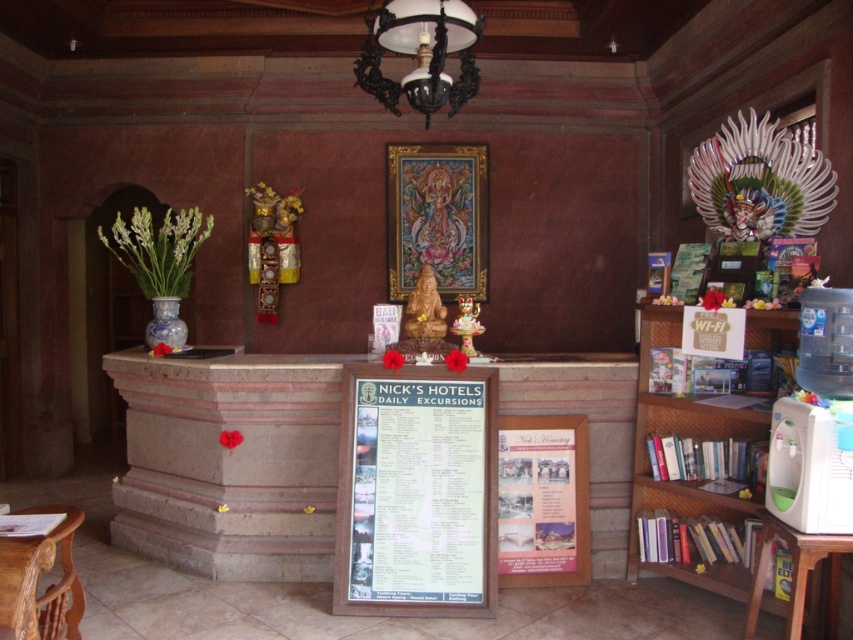
Which of these two, white matte lampshade at upper center or wooden table at lower left, stands taller?

Standing taller between the two is white matte lampshade at upper center.

At what (x,y) coordinates should I click in order to perform the action: click on white matte lampshade at upper center. Please return your answer as a coordinate pair (x, y). The image size is (853, 640). Looking at the image, I should click on (421, 52).

Locate an element on the screen. white matte lampshade at upper center is located at coordinates (421, 52).

Can you confirm if white paper poster at center is positioned above white matte lampshade at upper center?

Actually, white paper poster at center is below white matte lampshade at upper center.

Is white paper poster at center smaller than white matte lampshade at upper center?

Indeed, white paper poster at center has a smaller size compared to white matte lampshade at upper center.

Where is `white paper poster at center`? The width and height of the screenshot is (853, 640). white paper poster at center is located at coordinates (416, 492).

Between point (654, 340) and point (782, 525), which one is positioned in front?

Positioned in front is point (782, 525).

The width and height of the screenshot is (853, 640). Describe the element at coordinates (688, 481) in the screenshot. I see `wooden bookshelf at right` at that location.

This screenshot has width=853, height=640. In order to click on wooden bookshelf at right in this screenshot , I will do `click(688, 481)`.